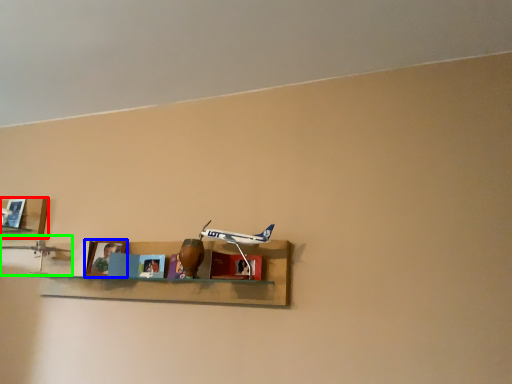
Question: Based on their relative distances, which object is nearer to shelf (highlighted by a red box)? Choose from picture frame (highlighted by a blue box) and toy (highlighted by a green box).

Choices:
 (A) picture frame
 (B) toy

Answer: (B)